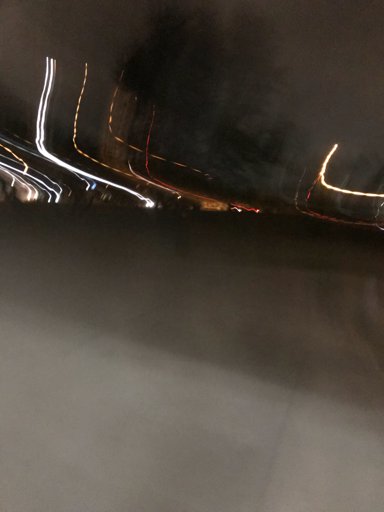
At what (x,y) coordinates should I click in order to perform the action: click on light floor. Please return your answer as a coordinate pair (x, y). The image size is (384, 512). Looking at the image, I should click on (205, 448).